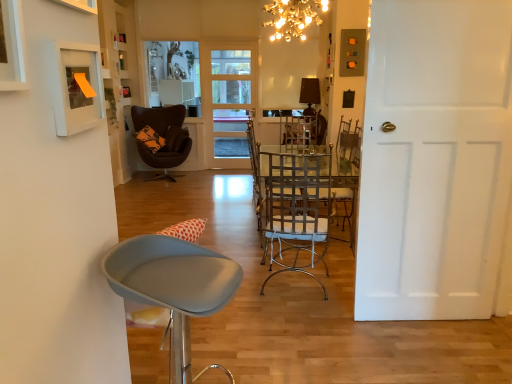
Image resolution: width=512 pixels, height=384 pixels. Find the location of `white matte picture frame at upper left, which is the 1th picture frame from bottom to top`. white matte picture frame at upper left, which is the 1th picture frame from bottom to top is located at coordinates (76, 87).

The width and height of the screenshot is (512, 384). Describe the element at coordinates (228, 99) in the screenshot. I see `clear glass door at center, the second door positioned from the front` at that location.

Where is `metallic switch plate at upper right, the third picture frame when ordered from front to back`? The height and width of the screenshot is (384, 512). metallic switch plate at upper right, the third picture frame when ordered from front to back is located at coordinates (352, 52).

What is the approximate width of dark brown leather chair at center, which is counted as the first chair, starting from the back?

29.75 inches.

You are a GUI agent. You are given a task and a screenshot of the screen. Output one action in this format:
    pyautogui.click(x=<x>, y=<y>)
    Task: Click on the white matte door at right, marked as the second door in a back-to-front arrangement
    
    Given the screenshot: What is the action you would take?
    [x=434, y=159]

Locate an element on the screen. shiny gold chandelier at upper center, the 2th lamp positioned from the right is located at coordinates (293, 17).

Which object is closer to the camera taking this photo, metallic silver chair at center, which ranks as the second chair in back-to-front order, or matte black lampshade at upper center, the first lamp viewed from the right?

metallic silver chair at center, which ranks as the second chair in back-to-front order, is in front.

From the image's perspective, which is below, metallic silver chair at center, which ranks as the 2th chair in front-to-back order, or matte black lampshade at upper center, the 2th lamp when ordered from front to back?

metallic silver chair at center, which ranks as the 2th chair in front-to-back order, appears lower in the image.

Consider the image. Between metallic silver chair at center, which ranks as the 2th chair in front-to-back order, and matte black lampshade at upper center, the 2th lamp when ordered from front to back, which one appears on the right side from the viewer's perspective?

From the viewer's perspective, matte black lampshade at upper center, the 2th lamp when ordered from front to back, appears more on the right side.

Does metallic silver chair at center, arranged as the third chair when viewed from the left, have a greater height compared to matte black lampshade at upper center, the 1th lamp in the back-to-front sequence?

Correct, metallic silver chair at center, arranged as the third chair when viewed from the left, is much taller as matte black lampshade at upper center, the 1th lamp in the back-to-front sequence.

Can you confirm if matte gray stool at lower left, the third chair in the back-to-front sequence, is wider than white matte picture frame at upper left, which is the 1th picture frame from bottom to top?

Indeed, matte gray stool at lower left, the third chair in the back-to-front sequence, has a greater width compared to white matte picture frame at upper left, which is the 1th picture frame from bottom to top.

Which object is further away from the camera taking this photo, matte gray stool at lower left, acting as the second chair starting from the left, or white matte picture frame at upper left, the 2th picture frame in the right-to-left sequence?

matte gray stool at lower left, acting as the second chair starting from the left, is further away from the camera.

From the image's perspective, which one is positioned higher, matte gray stool at lower left, which is counted as the 2th chair, starting from the right, or white matte picture frame at upper left, positioned as the second picture frame in back-to-front order?

white matte picture frame at upper left, positioned as the second picture frame in back-to-front order.

Does white matte picture frame at upper left, acting as the 1th picture frame starting from the front, appear on the right side of white matte door at right, acting as the first door starting from the right?

In fact, white matte picture frame at upper left, acting as the 1th picture frame starting from the front, is to the left of white matte door at right, acting as the first door starting from the right.

Based on their sizes in the image, would you say white matte picture frame at upper left, acting as the 1th picture frame starting from the front, is bigger or smaller than white matte door at right, which is counted as the 2th door, starting from the left?

Clearly, white matte picture frame at upper left, acting as the 1th picture frame starting from the front, is smaller in size than white matte door at right, which is counted as the 2th door, starting from the left.

At what (x,y) coordinates should I click in order to perform the action: click on the 2nd picture frame in front of the white matte door at right, arranged as the 1th door when viewed from the front, counting from the anchor's position. Please return your answer as a coordinate pair (x, y). Looking at the image, I should click on (12, 48).

In terms of height, does shiny gold chandelier at upper center, arranged as the first lamp when viewed from the left, look taller or shorter compared to matte gray stool at lower left, which is counted as the 2th chair, starting from the right?

Clearly, shiny gold chandelier at upper center, arranged as the first lamp when viewed from the left, is shorter compared to matte gray stool at lower left, which is counted as the 2th chair, starting from the right.

Does point (291, 30) appear closer or farther from the camera than point (228, 376)?

Point (291, 30) is farther from the camera than point (228, 376).

From a real-world perspective, between shiny gold chandelier at upper center, which is the 1th lamp from front to back, and matte gray stool at lower left, the 1th chair when ordered from front to back, who is vertically lower?

In real-world perspective, matte gray stool at lower left, the 1th chair when ordered from front to back, is lower.

Which of these two, shiny gold chandelier at upper center, which is the 1th lamp from front to back, or matte gray stool at lower left, acting as the second chair starting from the left, is thinner?

matte gray stool at lower left, acting as the second chair starting from the left.

Which is closer to the camera, (90, 81) or (351, 65)?

The point (90, 81) is closer.

I want to click on picture frame that is the 1st one when counting leftward from the metallic switch plate at upper right, the 1th picture frame when ordered from top to bottom, so click(x=76, y=87).

From a real-world perspective, is white matte picture frame at upper left, the 2th picture frame in the right-to-left sequence, beneath metallic switch plate at upper right, the 3th picture frame from the bottom?

Correct, in the physical world, white matte picture frame at upper left, the 2th picture frame in the right-to-left sequence, is lower than metallic switch plate at upper right, the 3th picture frame from the bottom.

Consider the image. Is matte black lampshade at upper center, which ranks as the 2th lamp in left-to-right order, at the back of matte gray stool at lower left, acting as the second chair starting from the left?

matte gray stool at lower left, acting as the second chair starting from the left, does not have its back to matte black lampshade at upper center, which ranks as the 2th lamp in left-to-right order.

Can you confirm if matte gray stool at lower left, which is counted as the 2th chair, starting from the right, is positioned to the right of matte black lampshade at upper center, the 2th lamp when ordered from front to back?

No, matte gray stool at lower left, which is counted as the 2th chair, starting from the right, is not to the right of matte black lampshade at upper center, the 2th lamp when ordered from front to back.

Between matte gray stool at lower left, the third chair in the back-to-front sequence, and matte black lampshade at upper center, the 1th lamp in the back-to-front sequence, which one has larger width?

matte gray stool at lower left, the third chair in the back-to-front sequence, is wider.

Does matte gray stool at lower left, the third chair in the back-to-front sequence, touch matte black lampshade at upper center, the 2th lamp when ordered from front to back?

They are not placed beside each other.

Identify the location of door that is on the left side of matte gray stool at lower left, the 1th chair when ordered from front to back. (228, 99).

Does clear glass door at center, which is the second door from right to left, turn towards matte gray stool at lower left, acting as the second chair starting from the left?

Yes, clear glass door at center, which is the second door from right to left, is facing matte gray stool at lower left, acting as the second chair starting from the left.

Considering the relative sizes of clear glass door at center, which is the 1th door in left-to-right order, and matte gray stool at lower left, the 1th chair when ordered from front to back, in the image provided, is clear glass door at center, which is the 1th door in left-to-right order, shorter than matte gray stool at lower left, the 1th chair when ordered from front to back,?

In fact, clear glass door at center, which is the 1th door in left-to-right order, may be taller than matte gray stool at lower left, the 1th chair when ordered from front to back.

How many degrees apart are the facing directions of clear glass door at center, which appears as the 1th door when viewed from the back, and matte gray stool at lower left, the third chair in the back-to-front sequence?

The facing directions of clear glass door at center, which appears as the 1th door when viewed from the back, and matte gray stool at lower left, the third chair in the back-to-front sequence, are 74.8 degrees apart.

From the image's perspective, which lamp is the 1st one above the metallic silver chair at center, the first chair positioned from the right? Please provide its 2D coordinates.

[(310, 95)]

Starting from the matte gray stool at lower left, which is counted as the 2th chair, starting from the right, which picture frame is the 1st one in front? Please provide its 2D coordinates.

[(76, 87)]

Looking at the image, which one is located closer to metallic switch plate at upper right, the 3th picture frame positioned from the left, dark brown leather chair at center, which is the third chair from right to left, or white matte door at right, arranged as the 1th door when viewed from the front?

Based on the image, white matte door at right, arranged as the 1th door when viewed from the front, appears to be nearer to metallic switch plate at upper right, the 3th picture frame positioned from the left.

Which object lies nearer to the anchor point white matte picture frame at upper left, positioned as the second picture frame in top-to-bottom order, white matte picture frame at upper left, which is the 1th picture frame from bottom to top, or white matte door at right, arranged as the 1th door when viewed from the front?

white matte picture frame at upper left, which is the 1th picture frame from bottom to top, lies closer to white matte picture frame at upper left, positioned as the second picture frame in top-to-bottom order, than the other object.

Based on their spatial positions, is white matte door at right, arranged as the 1th door when viewed from the front, or white matte picture frame at upper left, which is counted as the 2th picture frame, starting from the left, further from matte gray stool at lower left, the third chair in the back-to-front sequence?

Among the two, white matte door at right, arranged as the 1th door when viewed from the front, is located further to matte gray stool at lower left, the third chair in the back-to-front sequence.

Consider the image. When comparing their distances from white matte picture frame at upper left, which is the first picture frame from left to right, does metallic switch plate at upper right, acting as the 1th picture frame starting from the back, or white matte door at right, which is counted as the 2th door, starting from the left, seem closer?

white matte door at right, which is counted as the 2th door, starting from the left, is closer to white matte picture frame at upper left, which is the first picture frame from left to right.

Looking at the image, which one is located closer to clear glass door at center, the second door positioned from the front, matte gray stool at lower left, acting as the second chair starting from the left, or dark brown leather chair at center, the third chair in the front-to-back sequence?

Among the two, dark brown leather chair at center, the third chair in the front-to-back sequence, is located nearer to clear glass door at center, the second door positioned from the front.

Which object lies further to the anchor point shiny gold chandelier at upper center, arranged as the first lamp when viewed from the left, matte gray stool at lower left, acting as the second chair starting from the left, or matte black lampshade at upper center, the 2th lamp when ordered from front to back?

matte gray stool at lower left, acting as the second chair starting from the left, is further to shiny gold chandelier at upper center, arranged as the first lamp when viewed from the left.

When comparing their distances from matte black lampshade at upper center, the 2th lamp when ordered from front to back, does dark brown leather chair at center, the third chair in the front-to-back sequence, or metallic switch plate at upper right, the 3th picture frame from the bottom, seem closer?

metallic switch plate at upper right, the 3th picture frame from the bottom, is positioned closer to the anchor matte black lampshade at upper center, the 2th lamp when ordered from front to back.

From the image, which object appears to be nearer to white matte door at right, marked as the second door in a back-to-front arrangement, clear glass door at center, which is the 1th door in left-to-right order, or white matte picture frame at upper left, acting as the 1th picture frame starting from the front?

white matte picture frame at upper left, acting as the 1th picture frame starting from the front, is closer to white matte door at right, marked as the second door in a back-to-front arrangement.

Identify the location of picture frame between white matte picture frame at upper left, positioned as the second picture frame in top-to-bottom order, and shiny gold chandelier at upper center, the 2th lamp positioned from the right, from front to back. This screenshot has width=512, height=384. (76, 87).

Locate an element on the screen. The width and height of the screenshot is (512, 384). door between white matte picture frame at upper left, positioned as the second picture frame in top-to-bottom order, and shiny gold chandelier at upper center, the 2th lamp positioned from the right, from front to back is located at coordinates (434, 159).

Image resolution: width=512 pixels, height=384 pixels. I want to click on lamp positioned between shiny gold chandelier at upper center, arranged as the first lamp when viewed from the left, and clear glass door at center, which appears as the 1th door when viewed from the back, from near to far, so click(x=310, y=95).

This screenshot has height=384, width=512. I want to click on picture frame positioned between white matte picture frame at upper left, which is the 1th picture frame from bottom to top, and matte black lampshade at upper center, the first lamp viewed from the right, from near to far, so click(352, 52).